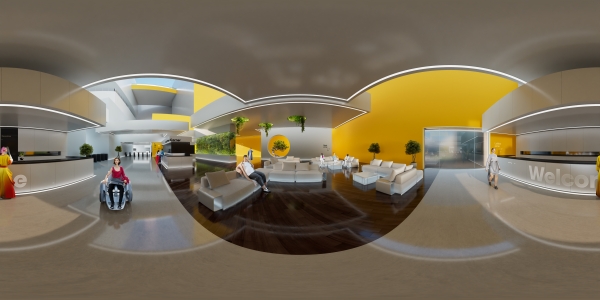
Locate an element on the screen. welcome sign is located at coordinates (562, 180).